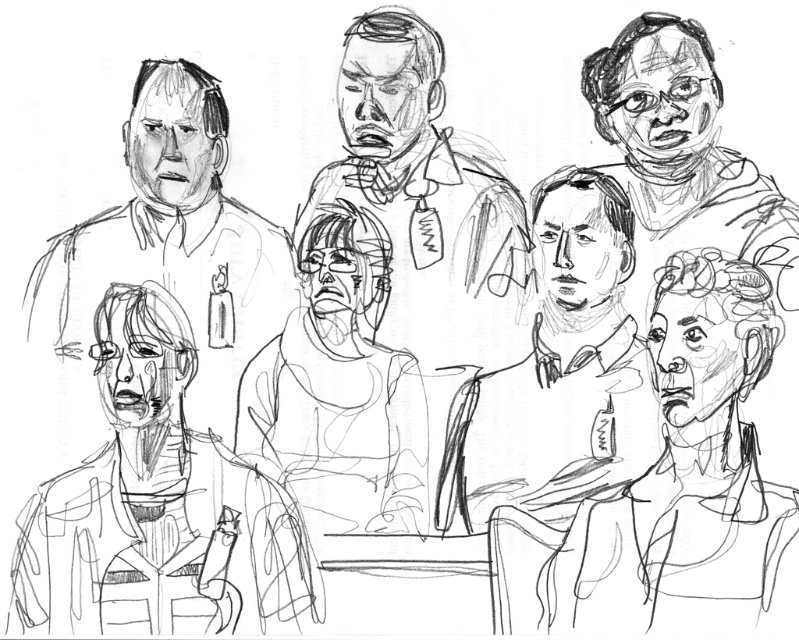
In the courtroom scene, there are two individuals with distinct features. The first is the smooth paper man at center, and the second is the smooth skin face at upper right. Based on their positions and sizes, which one do you think is closer to the observer?

The smooth paper man at center is much taller than the smooth skin face at upper right, so the smooth paper man at center is closer to the observer because objects closer to the viewer appear larger in size.

Looking at this image, based on the scene description, which object is wider? The smooth paper man at center or the matte black shirt at upper left?

The matte black shirt at upper left is wider than the smooth paper man at center.

In the courtroom scene, you notice two distinct elements among the figures depicted in the black and white sketch. The first is the matte black shirt at upper left, and the second is the smooth skin face at upper right. Based on their positions and sizes in the image, which of these two elements is larger in height?

The matte black shirt at upper left is much taller than the smooth skin face at upper right, so the matte black shirt at upper left is larger in height.